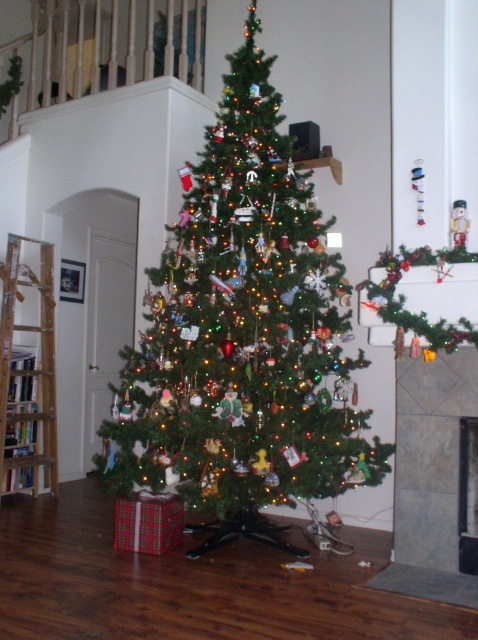
Question: Does wooden ladder at left have a smaller size compared to white marble fireplace at center?

Choices:
 (A) yes
 (B) no

Answer: (B)

Question: Which of the following is the closest to the observer?

Choices:
 (A) tap(445, 387)
 (B) tap(202, 502)
 (C) tap(471, 440)

Answer: (B)

Question: Considering the real-world distances, which object is farthest from the white marble fireplace at center?

Choices:
 (A) green matte christmas tree at center
 (B) wooden ladder at left
 (C) gray tile fireplace at lower right

Answer: (B)

Question: Is gray tile fireplace at lower right wider than wooden ladder at left?

Choices:
 (A) no
 (B) yes

Answer: (A)

Question: Which of these objects is positioned farthest from the gray tile fireplace at lower right?

Choices:
 (A) wooden ladder at left
 (B) white marble fireplace at center

Answer: (A)

Question: Can you confirm if gray tile fireplace at lower right is thinner than wooden ladder at left?

Choices:
 (A) yes
 (B) no

Answer: (A)